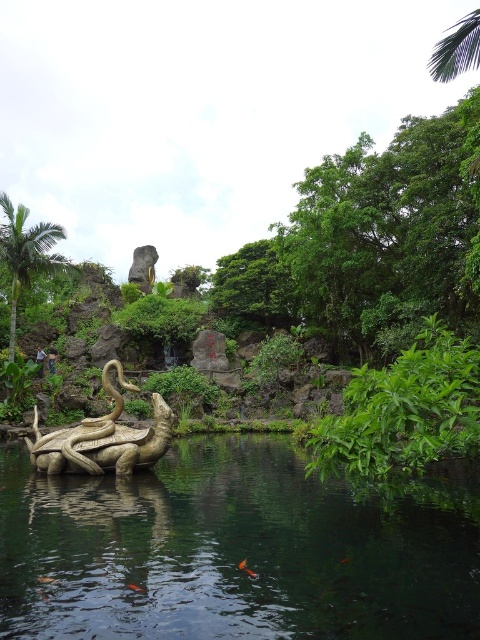
You are standing in the garden and want to place a small decorative stone between the two points, point (260, 550) and point (143, 593). To ensure it stays closer to you, should you place it closer to which point?

You should place the stone closer to point (143, 593) because it is closer to you than point (260, 550). This ensures the stone remains nearer to your position.

Looking at this image, you are a photographer planning to capture the shiny bronze octopus at center and the green leafy tree at upper left in a single frame. Based on their sizes in the image, which object will appear smaller in the photo?

The shiny bronze octopus at center will appear smaller in the photo because it has a lesser height compared to the green leafy tree at upper left.

You are a photographer trying to capture the shiny bronze octopus at center and the green leafy tree at upper left in the same frame. Based on their positions, which object should you adjust your camera to focus on first if you want to include both in your shot?

The shiny bronze octopus at center is to the right of green leafy tree at upper left, so you should focus on the green leafy tree at upper left first to ensure both are in the frame.